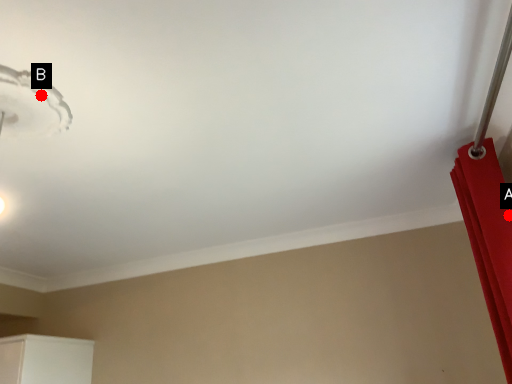
Question: Two points are circled on the image, labeled by A and B beside each circle. Among these points, which one is nearest to the camera?

Choices:
 (A) A is closer
 (B) B is closer

Answer: (B)